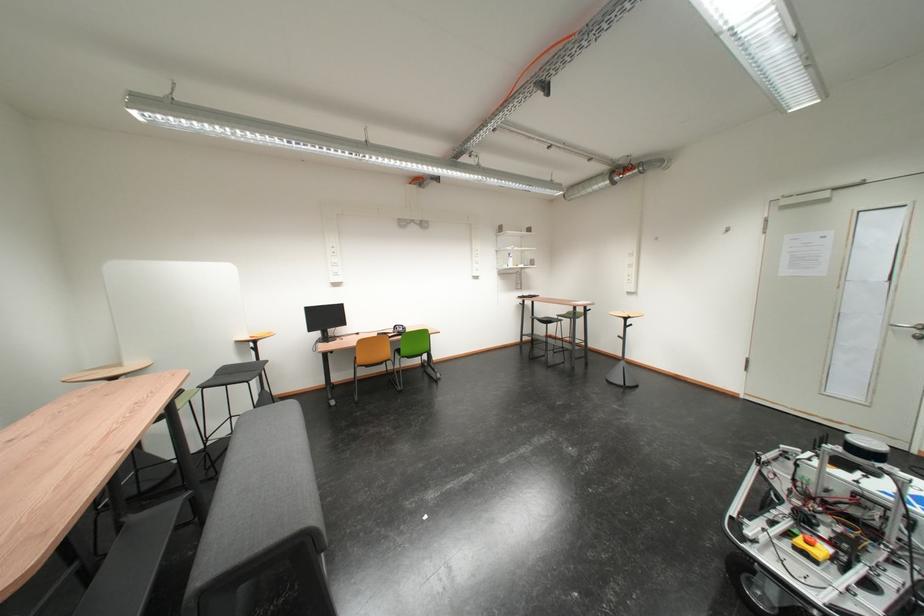
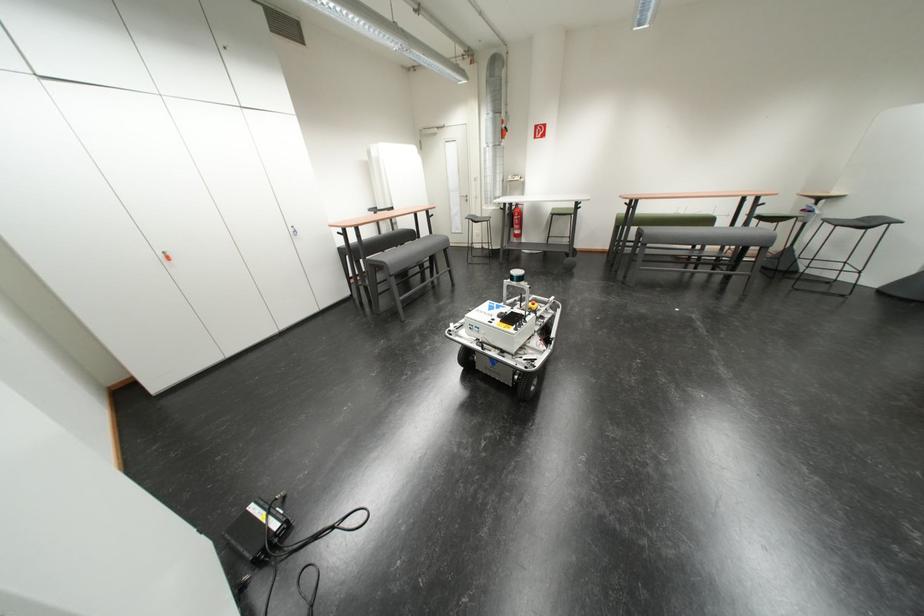
The point at (215, 389) is marked in the first image. Where is the corresponding point in the second image?

(837, 223)